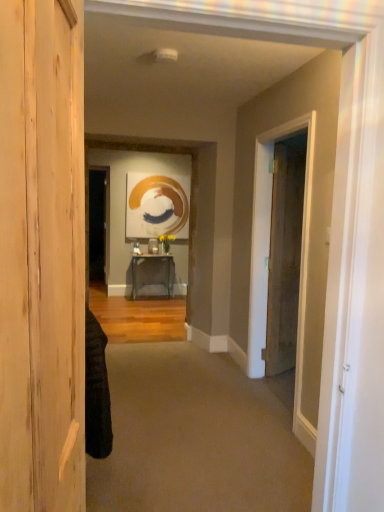
Question: From a real-world perspective, is metallic gray table at center physically located above or below carpet at center?

Choices:
 (A) above
 (B) below

Answer: (A)

Question: Is metallic gray table at center inside the boundaries of carpet at center, or outside?

Choices:
 (A) inside
 (B) outside

Answer: (B)

Question: Based on their relative distances, which object is nearer to the brown wood door at right, which appears as the first door when viewed from the right?

Choices:
 (A) natural wood door at left, which ranks as the first door in front-to-back order
 (B) carpet at center
 (C) metallic gray table at center

Answer: (B)

Question: Which of these objects is positioned farthest from the carpet at center?

Choices:
 (A) metallic gray table at center
 (B) brown wood door at right, the second door in the front-to-back sequence
 (C) natural wood door at left, which ranks as the first door in front-to-back order

Answer: (A)